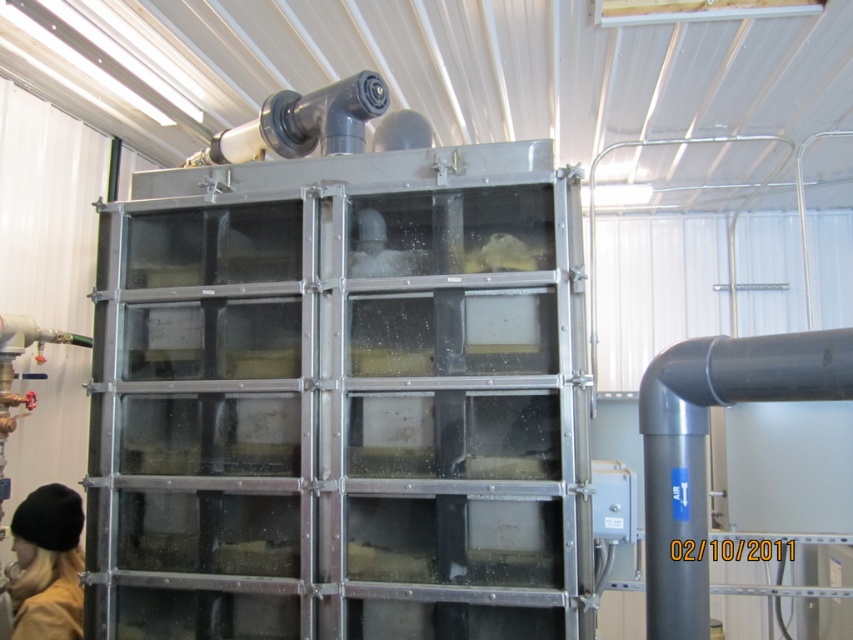
Question: Among these points, which one is nearest to the camera?

Choices:
 (A) (223, 131)
 (B) (61, 500)

Answer: (B)

Question: Considering the relative positions of black knit hat at lower left and matte black pipe at upper center in the image provided, where is black knit hat at lower left located with respect to matte black pipe at upper center?

Choices:
 (A) below
 (B) above

Answer: (A)

Question: Does black knit hat at lower left have a smaller size compared to matte black pipe at upper center?

Choices:
 (A) yes
 (B) no

Answer: (A)

Question: Is black knit hat at lower left bigger than matte black pipe at upper center?

Choices:
 (A) no
 (B) yes

Answer: (A)

Question: Which point is closer to the camera?

Choices:
 (A) (38, 502)
 (B) (378, 115)

Answer: (B)